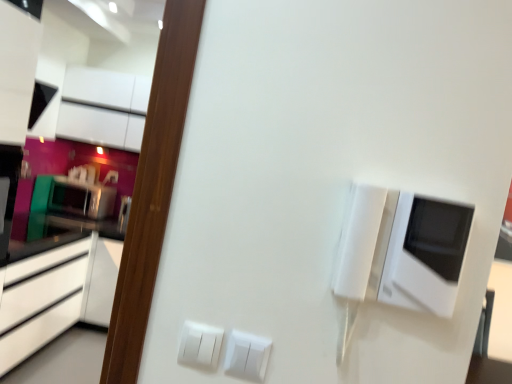
Question: Considering the positions of white glossy cabinetry at upper left, which is the second cabinetry in bottom-to-top order, and satin black microwave at left, the second appliance from the right, in the image, is white glossy cabinetry at upper left, which is the second cabinetry in bottom-to-top order, taller or shorter than satin black microwave at left, the second appliance from the right,?

Choices:
 (A) tall
 (B) short

Answer: (A)

Question: Considering their positions, is white glossy cabinetry at upper left, acting as the 2th cabinetry starting from the top, located in front of or behind satin black microwave at left, the second appliance from the right?

Choices:
 (A) behind
 (B) front

Answer: (B)

Question: Which is nearer to the matte black cabinet at upper left, arranged as the 1th cabinetry when viewed from the top?

Choices:
 (A) white plastic switch at lower center, placed as the 2th electric outlet when sorted from left to right
 (B) satin black microwave at left, which is counted as the 2th appliance, starting from the front
 (C) white glossy cabinetry at left, placed as the third cabinetry when sorted from top to bottom
 (D) white plastic switch at lower center, marked as the 2th electric outlet in a right-to-left arrangement
 (E) white glossy microwave at upper right, which appears as the 2th appliance when viewed from the left

Answer: (C)

Question: Which of these objects is positioned farthest from the white glossy cabinetry at left, placed as the third cabinetry when sorted from top to bottom?

Choices:
 (A) white glossy microwave at upper right, the first appliance positioned from the front
 (B) white plastic switch at lower center, placed as the 2th electric outlet when sorted from left to right
 (C) matte black cabinet at upper left, arranged as the 1th cabinetry when viewed from the top
 (D) satin black microwave at left, the first appliance when ordered from left to right
 (E) white plastic switch at lower center, the first electric outlet viewed from the left

Answer: (A)